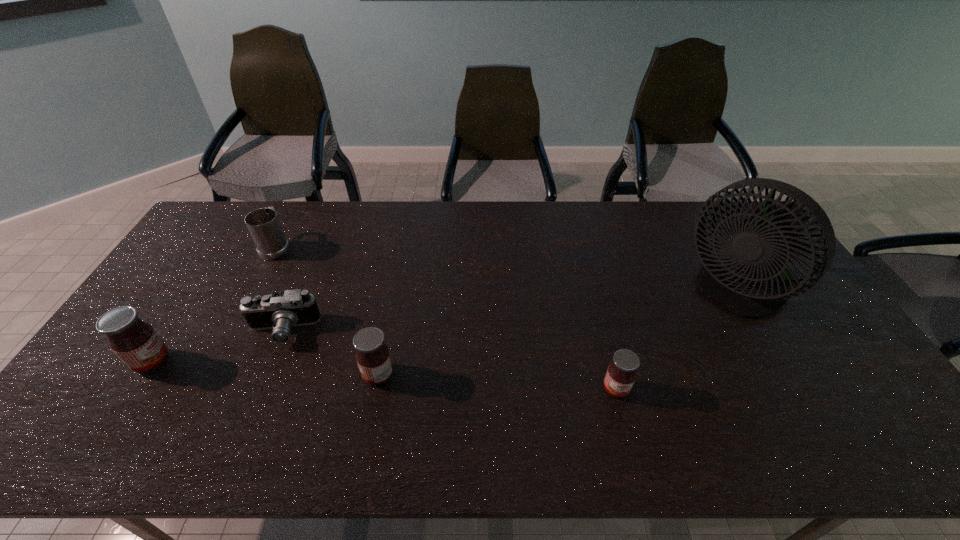
Find the location of a particular element. free spot between the mug and the tallest object is located at coordinates (507, 269).

Where is `vacant area that lies between the shortest object and the second jam from right to left`? This screenshot has width=960, height=540. vacant area that lies between the shortest object and the second jam from right to left is located at coordinates (330, 353).

You are a GUI agent. You are given a task and a screenshot of the screen. Output one action in this format:
    pyautogui.click(x=<x>, y=<y>)
    Task: Click on the free spot between the second jam from right to left and the mug
    The image size is (960, 540).
    Given the screenshot: What is the action you would take?
    pyautogui.click(x=327, y=310)

Where is `vacant point located between the leftmost jam and the second jam from right to left`? The image size is (960, 540). vacant point located between the leftmost jam and the second jam from right to left is located at coordinates pos(265,368).

Find the location of a particular element. The width and height of the screenshot is (960, 540). free space between the second jam from left to right and the leftmost object is located at coordinates (x=265, y=368).

What are the coordinates of `vacant space that is in between the leftmost jam and the camera` in the screenshot? It's located at (218, 346).

Locate an element on the screen. This screenshot has width=960, height=540. unoccupied position between the second object from right to left and the second jam from right to left is located at coordinates (497, 382).

Identify the location of object that stands as the fifth closest to the rightmost object. [x=137, y=344].

Select which object appears as the fifth closest to the second jam from right to left. Please provide its 2D coordinates. Your answer should be formatted as a tuple, i.e. [(x, y)], where the tuple contains the x and y coordinates of a point satisfying the conditions above.

[(743, 282)]

Identify which jam is the second closest to the second tallest jam. Please provide its 2D coordinates. Your answer should be formatted as a tuple, i.e. [(x, y)], where the tuple contains the x and y coordinates of a point satisfying the conditions above.

[(621, 373)]